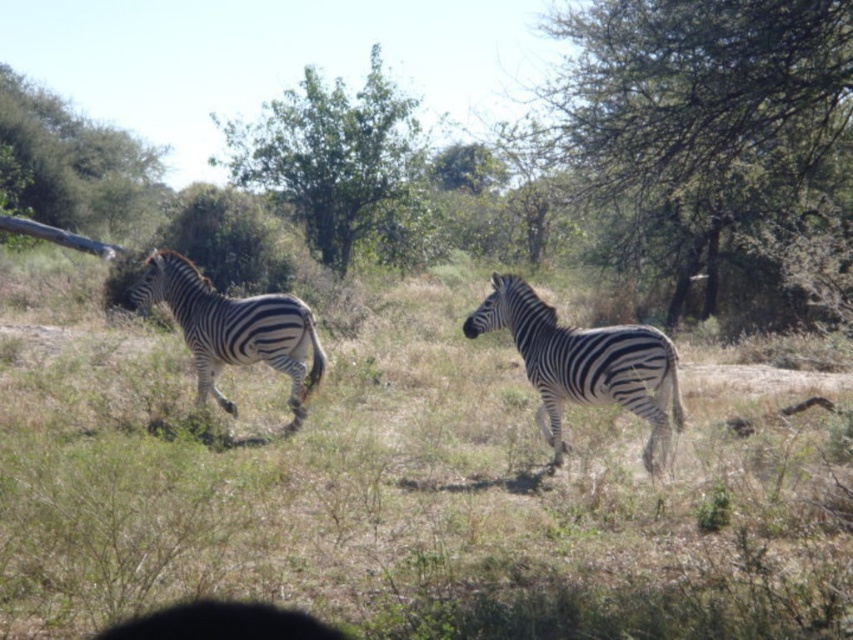
Does green leafy tree at upper left appear over black and white striped zebra at left?

Indeed, green leafy tree at upper left is positioned over black and white striped zebra at left.

Is green leafy tree at upper left thinner than black and white striped zebra at left?

No.

Measure the distance between green leafy tree at upper left and camera.

green leafy tree at upper left and camera are 28.78 meters apart.

Identify the location of green leafy tree at upper left. (70, 163).

Who is shorter, green leafy tree at center or black and white striped zebra at left?

black and white striped zebra at left is shorter.

Between green leafy tree at center and black and white striped zebra at left, which one is positioned higher?

green leafy tree at center is above.

Locate an element on the screen. The width and height of the screenshot is (853, 640). green leafy tree at center is located at coordinates (341, 166).

Is black and white striped zebra at center wider than black and white striped zebra at left?

Incorrect, black and white striped zebra at center's width does not surpass black and white striped zebra at left's.

Which is behind, point (473, 316) or point (209, 300)?

Positioned behind is point (209, 300).

The image size is (853, 640). Identify the location of black and white striped zebra at center. (584, 364).